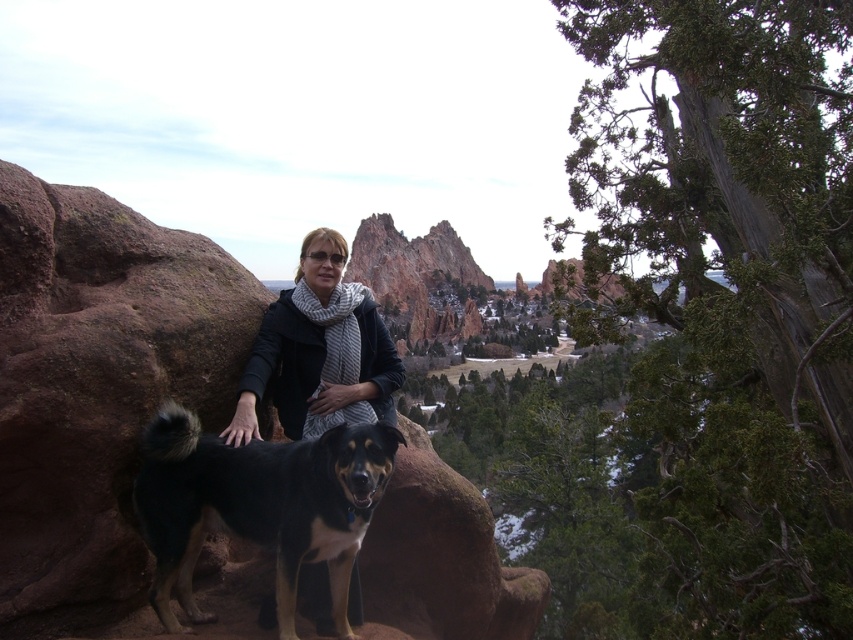
Is brown rock at center closer to the viewer compared to black woolen scarf at center?

Yes, it is.

Can you confirm if brown rock at center is taller than black woolen scarf at center?

Correct, brown rock at center is much taller as black woolen scarf at center.

Identify the location of brown rock at center. (97, 385).

From the picture: Which is below, black fur dog at center or black woolen scarf at center?

Positioned lower is black fur dog at center.

Does black fur dog at center have a lesser height compared to black woolen scarf at center?

Correct, black fur dog at center is not as tall as black woolen scarf at center.

Is point (262, 470) farther from camera compared to point (314, 257)?

That is False.

At what (x,y) coordinates should I click in order to perform the action: click on black fur dog at center. Please return your answer as a coordinate pair (x, y). Looking at the image, I should click on (258, 506).

Can you confirm if brown rock at center is positioned to the right of black fur dog at center?

Indeed, brown rock at center is positioned on the right side of black fur dog at center.

Does brown rock at center have a greater height compared to black fur dog at center?

Correct, brown rock at center is much taller as black fur dog at center.

You are a GUI agent. You are given a task and a screenshot of the screen. Output one action in this format:
    pyautogui.click(x=<x>, y=<y>)
    Task: Click on the brown rock at center
    This screenshot has height=640, width=853.
    Given the screenshot: What is the action you would take?
    pyautogui.click(x=97, y=385)